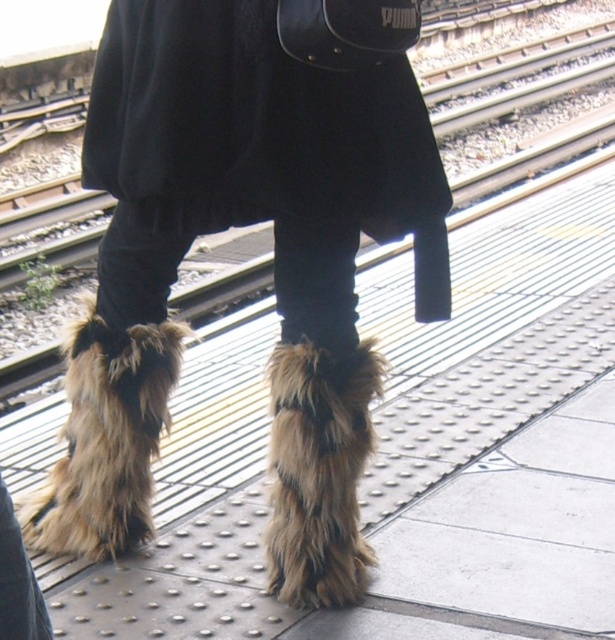
Between fuzzy fur leg warmers at center and fuzzy fur leg warmer at lower center, which one appears on the right side from the viewer's perspective?

fuzzy fur leg warmer at lower center

Where is `fuzzy fur leg warmers at center`? This screenshot has height=640, width=615. fuzzy fur leg warmers at center is located at coordinates (106, 440).

Is point (111, 362) positioned behind point (298, 419)?

Yes, it is behind point (298, 419).

Image resolution: width=615 pixels, height=640 pixels. I want to click on fuzzy fur leg warmers at center, so click(106, 440).

Is fuzzy fur boots at center above fuzzy fur leg warmer at lower center?

Indeed, fuzzy fur boots at center is positioned over fuzzy fur leg warmer at lower center.

Which of these two, fuzzy fur boots at center or fuzzy fur leg warmer at lower center, stands taller?

Standing taller between the two is fuzzy fur boots at center.

I want to click on fuzzy fur boots at center, so click(274, 253).

Who is more distant from viewer, (146, 138) or (52, 481)?

Point (52, 481)

I want to click on fuzzy fur boots at center, so click(274, 253).

Find the location of a particular element. fuzzy fur boots at center is located at coordinates (274, 253).